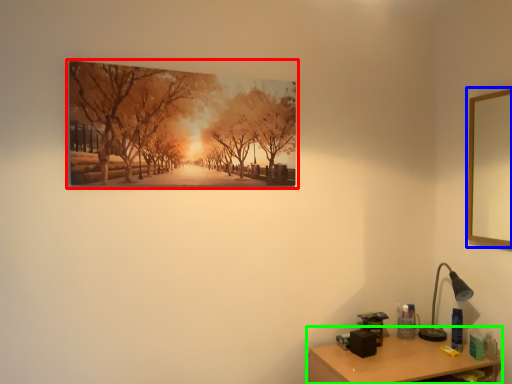
Question: Considering the real-world distances, which object is closest to picture frame (highlighted by a red box)? picture frame (highlighted by a blue box) or table (highlighted by a green box).

Choices:
 (A) picture frame
 (B) table

Answer: (B)